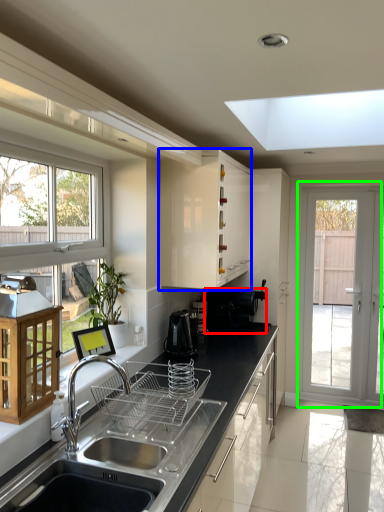
Question: Which object is positioned farthest from appliance (highlighted by a red box)? Select from cabinetry (highlighted by a blue box) and door (highlighted by a green box).

Choices:
 (A) cabinetry
 (B) door

Answer: (B)